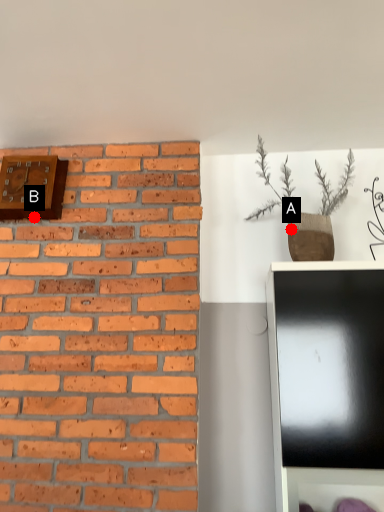
Question: Two points are circled on the image, labeled by A and B beside each circle. Which point appears farthest from the camera in this image?

Choices:
 (A) A is further
 (B) B is further

Answer: (B)